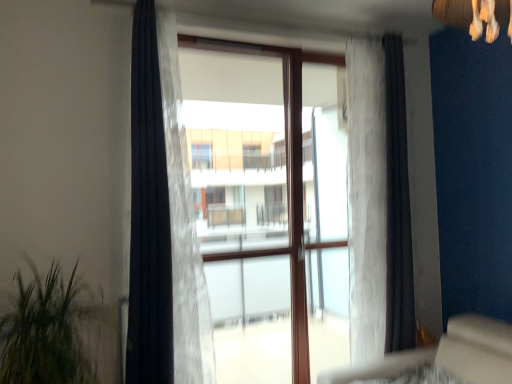
Question: Which is correct: black sheer curtain at left, which is the fourth curtain in right-to-left order, is inside black fabric curtain at right, the fourth curtain viewed from the left, or outside of it?

Choices:
 (A) inside
 (B) outside

Answer: (B)

Question: From the image's perspective, is black sheer curtain at left, which is the fourth curtain in right-to-left order, located above or below black fabric curtain at right, which appears as the 1th curtain when viewed from the right?

Choices:
 (A) below
 (B) above

Answer: (B)

Question: Which of these objects is positioned closest to the translucent fabric curtain at center, marked as the 3th curtain in a right-to-left arrangement?

Choices:
 (A) black sheer curtain at left, which is the fourth curtain in right-to-left order
 (B) transparent glass door at center
 (C) black fabric curtain at right, the fourth curtain viewed from the left
 (D) white sheer curtain at center, the second curtain in the right-to-left sequence
 (E) green leafy plant at left

Answer: (A)

Question: Considering the real-world distances, which object is farthest from the translucent fabric curtain at center, marked as the 3th curtain in a right-to-left arrangement?

Choices:
 (A) green leafy plant at left
 (B) transparent glass door at center
 (C) white sheer curtain at center, the third curtain positioned from the left
 (D) black sheer curtain at left, positioned as the 1th curtain in left-to-right order
 (E) black fabric curtain at right, the fourth curtain viewed from the left

Answer: (E)